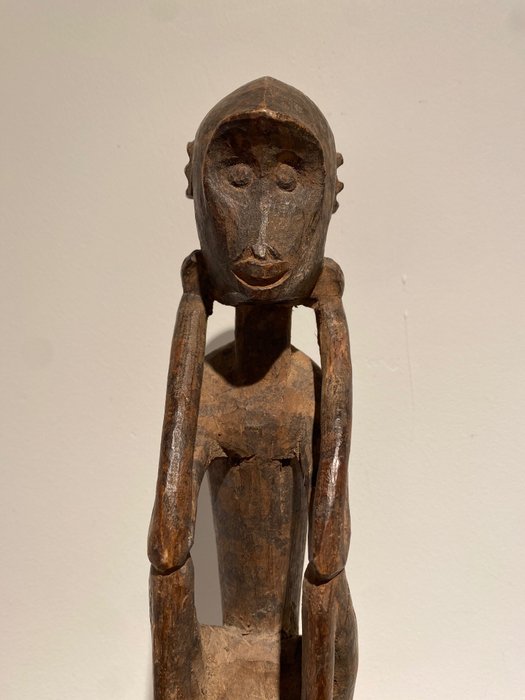
The width and height of the screenshot is (525, 700). I want to click on wooden sculpture, so click(x=254, y=404).